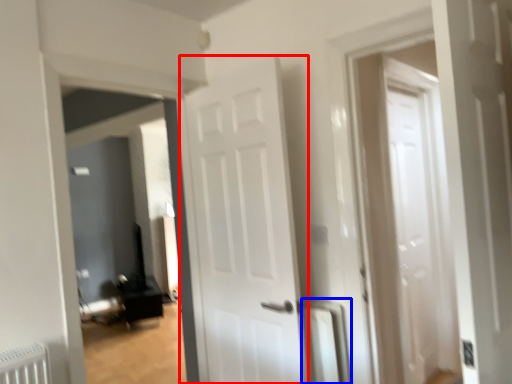
Question: Which object appears closest to the camera in this image, door (highlighted by a red box) or radiator (highlighted by a blue box)?

Choices:
 (A) door
 (B) radiator

Answer: (A)